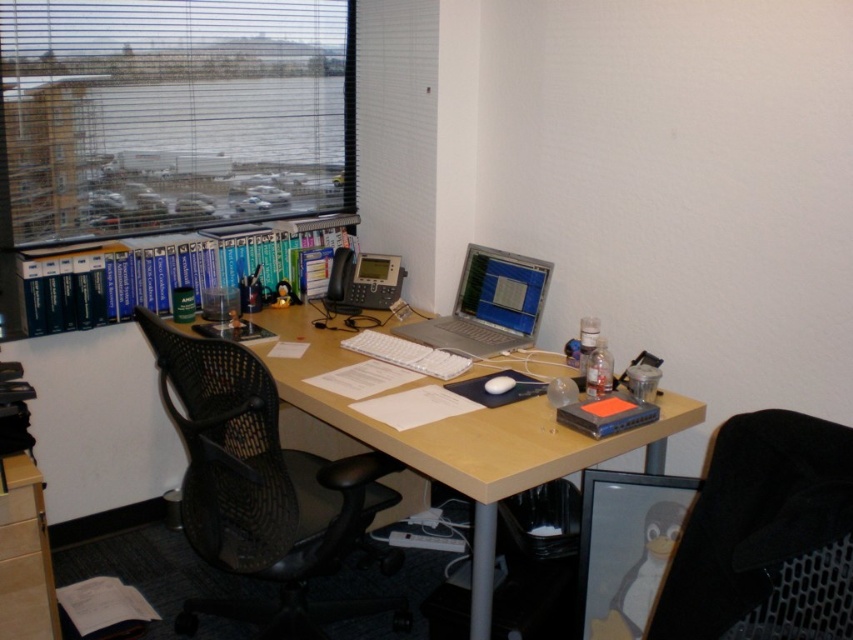
You are sitting in the black office chair with a mesh backrest and armrests at the desk. You need to reach both the point at coordinates (773, 564) and the point at coordinates (302, 228) on the desk. Which point should you reach for first if you want to minimize the distance you have to move your hand?

You should reach for point (302, 228) first because it is closer to you than point (773, 564). Since point (773, 564) is in front of point (302, 228), it is farther away from your current position.

You are organizing items on the desk and need to determine which object is narrower between the transparent plastic blinds at upper left and the blue hardcover books at upper left. Which one is narrower?

The transparent plastic blinds at upper left are narrower than the blue hardcover books at upper left according to the description.

You are standing in the office and want to place a new plant pot at the point marked as point (756,461). If the plant pot requires 2.5 feet of space in front of it to be safe, will there be enough space?

The distance of point (756,461) from camera is 3.76 feet, so there is enough space since 3.76 feet is greater than the required 2.5 feet.